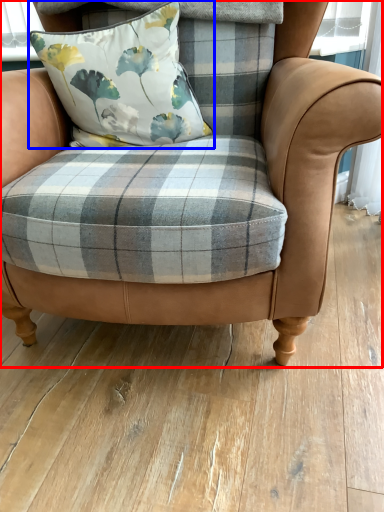
Question: Which point is further to the camera, chair (highlighted by a red box) or pillow (highlighted by a blue box)?

Choices:
 (A) chair
 (B) pillow

Answer: (B)